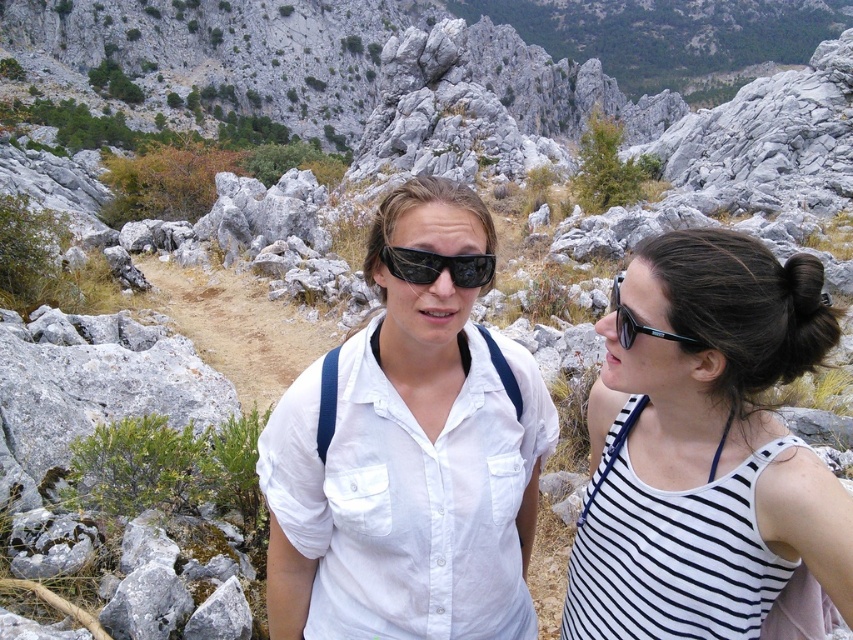
Find the location of a particular element. white cotton shirt at center is located at coordinates (706, 449).

Can you confirm if white cotton shirt at center is positioned to the right of black plastic sunglasses at right?

No, white cotton shirt at center is not to the right of black plastic sunglasses at right.

Identify the location of white cotton shirt at center. This screenshot has width=853, height=640. (706, 449).

This screenshot has width=853, height=640. What are the coordinates of `white cotton shirt at center` in the screenshot? It's located at (706, 449).

Is black plastic sunglasses at center to the right of black plastic sunglasses at right from the viewer's perspective?

In fact, black plastic sunglasses at center is to the left of black plastic sunglasses at right.

From the picture: Who is positioned more to the right, black plastic sunglasses at center or black plastic sunglasses at right?

black plastic sunglasses at right

Find the location of `black plastic sunglasses at center`. black plastic sunglasses at center is located at coordinates (437, 266).

Which is more to the right, white striped tank top at right or black plastic sunglasses at right?

black plastic sunglasses at right

Can you confirm if white striped tank top at right is thinner than black plastic sunglasses at right?

Correct, white striped tank top at right's width is less than black plastic sunglasses at right's.

What do you see at coordinates (704, 449) in the screenshot? I see `white striped tank top at right` at bounding box center [704, 449].

Identify the location of white striped tank top at right. (704, 449).